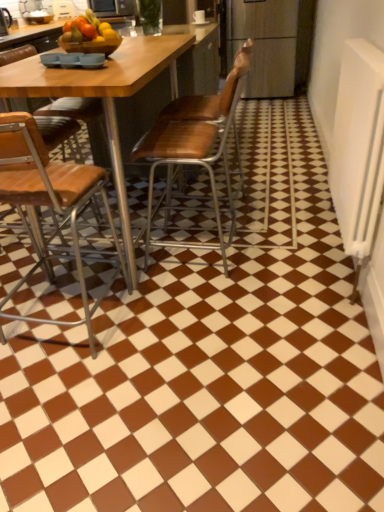
Image resolution: width=384 pixels, height=512 pixels. I want to click on free point to the right of wooden at center, which ranks as the second chair in left-to-right order, so click(x=290, y=258).